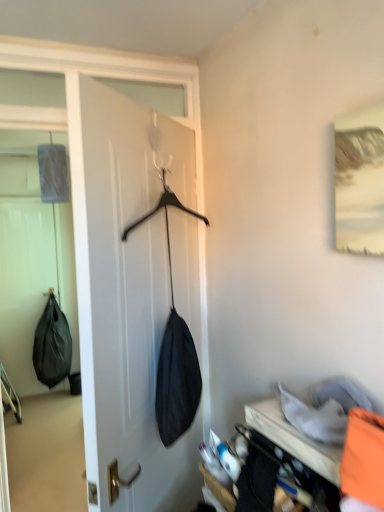
The width and height of the screenshot is (384, 512). Describe the element at coordinates (364, 458) in the screenshot. I see `orange fabric bag at lower right` at that location.

This screenshot has width=384, height=512. Find the location of `orange fabric at lower right`. orange fabric at lower right is located at coordinates (322, 441).

The width and height of the screenshot is (384, 512). What are the coordinates of `black matte coat hanger at center` in the screenshot? It's located at (123, 305).

You are a GUI agent. You are given a task and a screenshot of the screen. Output one action in this format:
    pyautogui.click(x=<x>, y=<y>)
    Task: Click on the orange fabric bag at lower right
    
    Given the screenshot: What is the action you would take?
    pyautogui.click(x=364, y=458)

This screenshot has height=512, width=384. Identify the location of furniture to the right of black matte coat hanger at center. (294, 439).

Is orange fabric pillow at lower right in contact with black matte coat hanger at center?

No, orange fabric pillow at lower right is not touching black matte coat hanger at center.

Between orange fabric pillow at lower right and black matte coat hanger at center, which one appears on the left side from the viewer's perspective?

black matte coat hanger at center.

Is orange fabric pillow at lower right not within black matte coat hanger at center?

That's correct, orange fabric pillow at lower right is outside of black matte coat hanger at center.

From the image's perspective, would you say orange fabric at lower right is shown under orange fabric bag at lower right?

Correct, orange fabric at lower right appears lower than orange fabric bag at lower right in the image.

Does orange fabric at lower right come behind orange fabric bag at lower right?

Yes, orange fabric at lower right is further from the camera.

Based on their sizes in the image, would you say orange fabric at lower right is bigger or smaller than orange fabric bag at lower right?

Considering their sizes, orange fabric at lower right takes up more space than orange fabric bag at lower right.

Can you confirm if orange fabric at lower right is thinner than orange fabric bag at lower right?

No.

Does black matte shoulder bag at left turn towards orange fabric pillow at lower right?

Yes, black matte shoulder bag at left is aimed at orange fabric pillow at lower right.

Considering the sizes of objects black matte shoulder bag at left and orange fabric pillow at lower right in the image provided, who is wider, black matte shoulder bag at left or orange fabric pillow at lower right?

With larger width is black matte shoulder bag at left.

What's the angular difference between black matte shoulder bag at left and orange fabric pillow at lower right's facing directions?

black matte shoulder bag at left and orange fabric pillow at lower right are facing 82.6 degrees away from each other.

Find the location of a particular element. The width and height of the screenshot is (384, 512). furniture located above the black matte shoulder bag at left (from a real-world perspective) is located at coordinates (294, 439).

Is black matte coat hanger at center oriented towards orange fabric bag at lower right?

No, black matte coat hanger at center is not facing towards orange fabric bag at lower right.

Is black matte coat hanger at center not within orange fabric bag at lower right?

Indeed, black matte coat hanger at center is completely outside orange fabric bag at lower right.

Which object is positioned more to the left, black matte coat hanger at center or orange fabric bag at lower right?

black matte coat hanger at center is more to the left.

From a real-world perspective, is orange fabric at lower right physically above orange fabric pillow at lower right?

No.

In the scene shown: Is orange fabric at lower right to the left or to the right of orange fabric pillow at lower right in the image?

From the image, it's evident that orange fabric at lower right is to the left of orange fabric pillow at lower right.

Image resolution: width=384 pixels, height=512 pixels. Identify the location of furniture above the orange fabric at lower right (from the image's perspective). (294, 439).

From a real-world perspective, is black matte coat hanger at center under orange fabric at lower right?

Actually, black matte coat hanger at center is physically above orange fabric at lower right in the real world.

Relative to orange fabric at lower right, is black matte coat hanger at center in front or behind?

black matte coat hanger at center is positioned farther from the viewer than orange fabric at lower right.

From the image's perspective, which one is positioned higher, black matte coat hanger at center or orange fabric at lower right?

black matte coat hanger at center.

Choose the correct answer: Is black matte coat hanger at center inside orange fabric at lower right or outside it?

black matte coat hanger at center is not enclosed by orange fabric at lower right.

Is the position of orange fabric bag at lower right more distant than that of orange fabric pillow at lower right?

No, it is in front of orange fabric pillow at lower right.

I want to click on clothing in front of the orange fabric pillow at lower right, so click(x=364, y=458).

Between orange fabric bag at lower right and orange fabric pillow at lower right, which one has less height?

With less height is orange fabric pillow at lower right.

In the scene shown: From a real-world perspective, which is physically below, orange fabric bag at lower right or orange fabric pillow at lower right?

In real-world perspective, orange fabric pillow at lower right is lower.

Find the location of a particular element. Image resolution: width=384 pixels, height=512 pixels. door on the left of orange fabric pillow at lower right is located at coordinates (123, 305).

Locate an element on the screen. Image resolution: width=384 pixels, height=512 pixels. clothing located above the orange fabric at lower right (from a real-world perspective) is located at coordinates (364, 458).

Which object lies further to the anchor point black matte coat hanger at center, orange fabric at lower right or black matte shoulder bag at left?

black matte shoulder bag at left is positioned further to the anchor black matte coat hanger at center.

Consider the image. When comparing their distances from orange fabric at lower right, does orange fabric pillow at lower right or black matte shoulder bag at left seem closer?

The object closer to orange fabric at lower right is orange fabric pillow at lower right.

Estimate the real-world distances between objects in this image. Which object is further from orange fabric pillow at lower right, orange fabric at lower right or orange fabric bag at lower right?

Among the two, orange fabric bag at lower right is located further to orange fabric pillow at lower right.

Based on their spatial positions, is black matte coat hanger at center or orange fabric bag at lower right further from orange fabric pillow at lower right?

black matte coat hanger at center lies further to orange fabric pillow at lower right than the other object.

Looking at this image, looking at the image, which one is located closer to orange fabric pillow at lower right, black matte shoulder bag at left or orange fabric at lower right?

orange fabric at lower right lies closer to orange fabric pillow at lower right than the other object.

Which object lies nearer to the anchor point orange fabric bag at lower right, orange fabric pillow at lower right or black matte shoulder bag at left?

Among the two, orange fabric pillow at lower right is located nearer to orange fabric bag at lower right.

Based on the photo, considering their positions, is black matte coat hanger at center positioned further to orange fabric at lower right than orange fabric bag at lower right?

Based on the image, black matte coat hanger at center appears to be further to orange fabric at lower right.

When comparing their distances from orange fabric pillow at lower right, does orange fabric bag at lower right or black matte shoulder bag at left seem closer?

The object closer to orange fabric pillow at lower right is orange fabric bag at lower right.

Locate an element on the screen. This screenshot has width=384, height=512. closet between orange fabric bag at lower right and orange fabric pillow at lower right from front to back is located at coordinates (322, 441).

This screenshot has width=384, height=512. I want to click on closet between black matte coat hanger at center and orange fabric bag at lower right in the horizontal direction, so click(x=322, y=441).

The image size is (384, 512). In order to click on door positioned between orange fabric bag at lower right and black matte shoulder bag at left from near to far in this screenshot , I will do `click(123, 305)`.

The height and width of the screenshot is (512, 384). Identify the location of furniture positioned between orange fabric bag at lower right and black matte shoulder bag at left from near to far. (294, 439).